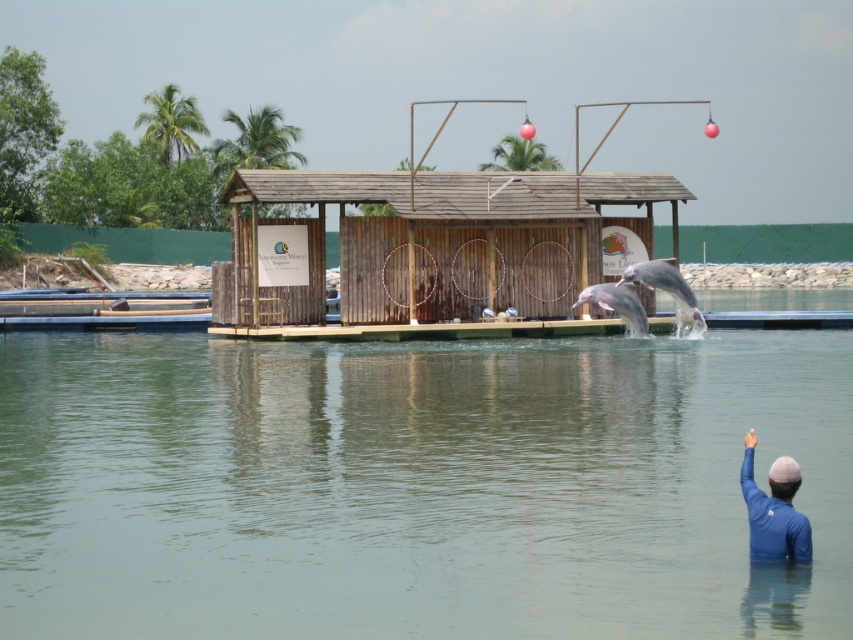
You are standing at the wooden structure and want to locate two points marked in the image. Which point is closer to you, point (759,536) or point (665,276)?

Point (759,536) is in front of point (665,276), so it is closer to you.

You are a marine biologist observing the dolphins from the wooden structure. You notice two dolphins, the pink smooth dolphin at center and the light gray smooth dolphin at center. Which dolphin is closer to you?

The pink smooth dolphin at center is closer to you because the light gray smooth dolphin at center is behind it.